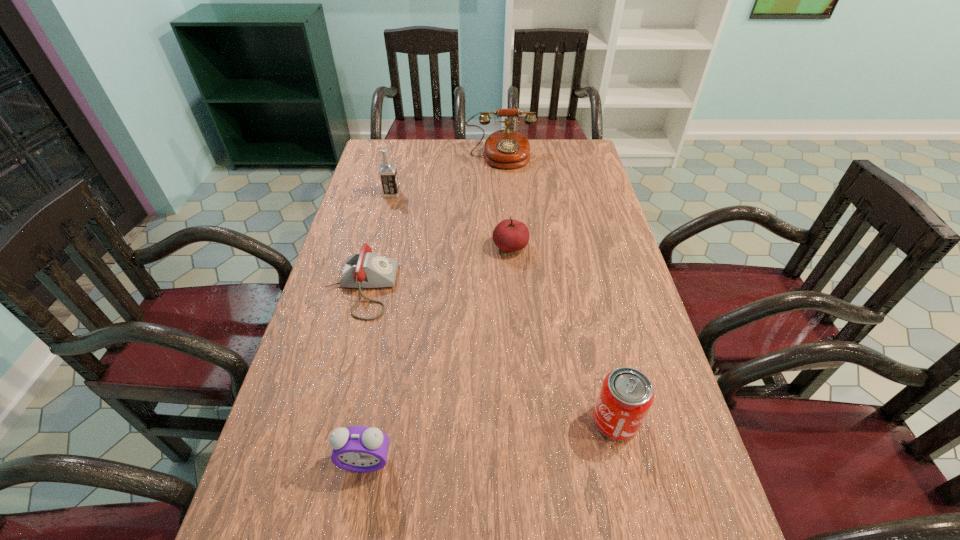
Locate an element on the screen. The width and height of the screenshot is (960, 540). the farthest object is located at coordinates (507, 149).

Locate an element on the screen. The width and height of the screenshot is (960, 540). the taller telephone is located at coordinates (507, 149).

I want to click on the fifth nearest object, so click(x=387, y=171).

The height and width of the screenshot is (540, 960). Find the location of `the rightmost object`. the rightmost object is located at coordinates (626, 395).

Locate an element on the screen. The height and width of the screenshot is (540, 960). can is located at coordinates (626, 395).

Locate an element on the screen. This screenshot has height=540, width=960. alarm clock is located at coordinates (363, 449).

Where is `the fourth nearest object`? This screenshot has width=960, height=540. the fourth nearest object is located at coordinates (510, 235).

What are the coordinates of `the shorter telephone` in the screenshot? It's located at (364, 269).

Locate an element on the screen. The image size is (960, 540). the nearer telephone is located at coordinates (364, 269).

The image size is (960, 540). I want to click on vacant space situated on the dial of the farther telephone, so click(504, 208).